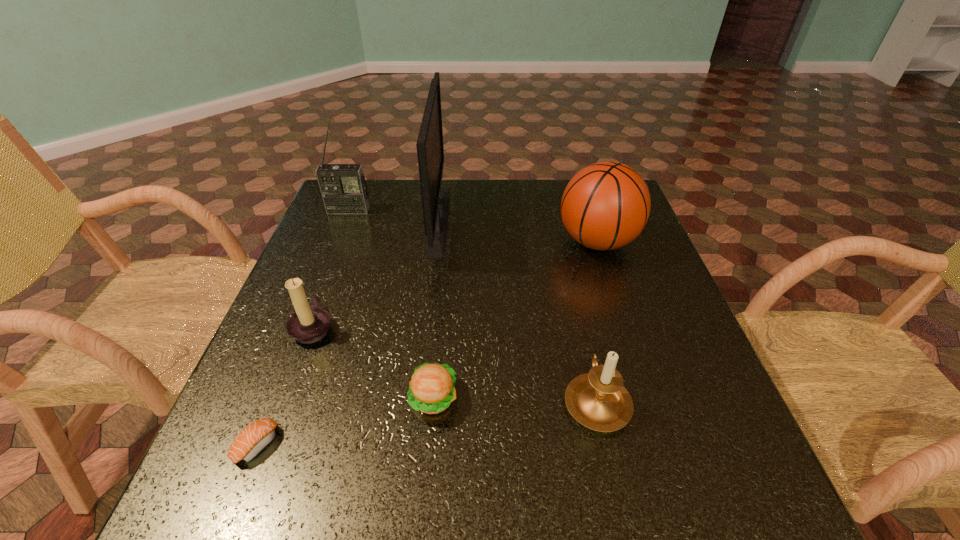
This screenshot has height=540, width=960. In order to click on free spot at the left edge of the desktop in this screenshot , I will do `click(325, 344)`.

The height and width of the screenshot is (540, 960). In the image, there is a desktop. What are the coordinates of `free space at the right edge` in the screenshot? It's located at (704, 382).

Image resolution: width=960 pixels, height=540 pixels. Find the location of `free space between the left candle holder and the second shortest object`. free space between the left candle holder and the second shortest object is located at coordinates (373, 362).

This screenshot has height=540, width=960. I want to click on free space that is in between the nearer candle holder and the farther candle holder, so click(x=455, y=363).

The image size is (960, 540). Identify the location of vacant area that lies between the shortest object and the fourth farthest object. (285, 385).

This screenshot has width=960, height=540. I want to click on vacant area that lies between the right candle holder and the tallest object, so click(517, 310).

Find the location of a particular element. The width and height of the screenshot is (960, 540). blank region between the second tallest object and the monitor is located at coordinates (394, 215).

Find the location of `vacant area that lies between the left candle holder and the sixth tallest object`. vacant area that lies between the left candle holder and the sixth tallest object is located at coordinates (373, 362).

Identify the location of free area in between the monitor and the farther candle holder. Image resolution: width=960 pixels, height=540 pixels. (376, 273).

The width and height of the screenshot is (960, 540). In order to click on empty location between the fifth shortest object and the second tallest object in this screenshot , I will do `click(473, 226)`.